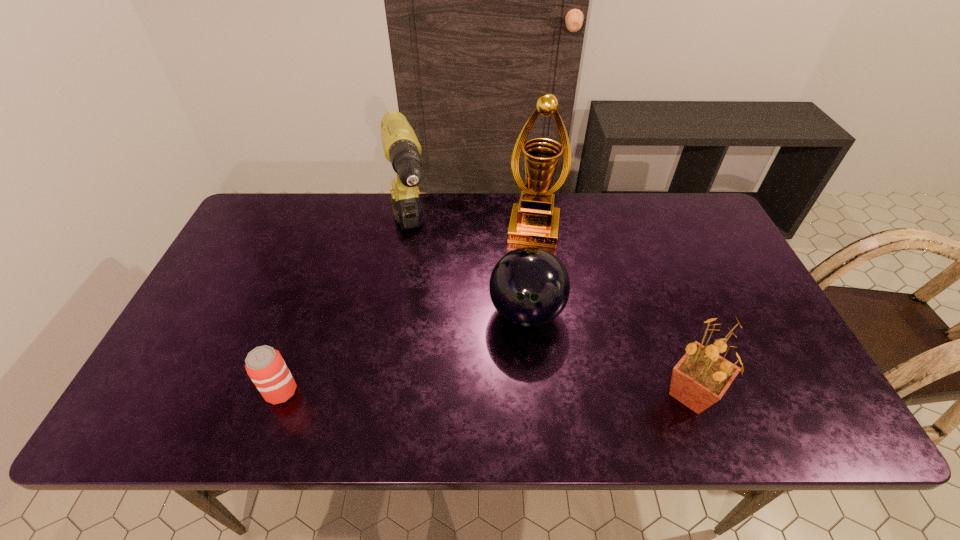
Find the location of a particular element. The width and height of the screenshot is (960, 540). the leftmost object is located at coordinates (265, 366).

I want to click on beer can, so click(265, 366).

Find the location of a particular element. sunflower is located at coordinates (702, 376).

Identify the location of the rightmost object. Image resolution: width=960 pixels, height=540 pixels. (702, 376).

This screenshot has width=960, height=540. I want to click on the fourth shortest object, so click(401, 147).

Identify the location of drill. The width and height of the screenshot is (960, 540). (401, 147).

Image resolution: width=960 pixels, height=540 pixels. Identify the location of award. (534, 220).

I want to click on the second shortest object, so click(529, 286).

Image resolution: width=960 pixels, height=540 pixels. What are the coordinates of `the third farthest object` in the screenshot? It's located at (529, 286).

The image size is (960, 540). In order to click on free space located 0.220m on the right of the beer can in this screenshot , I will do `click(396, 392)`.